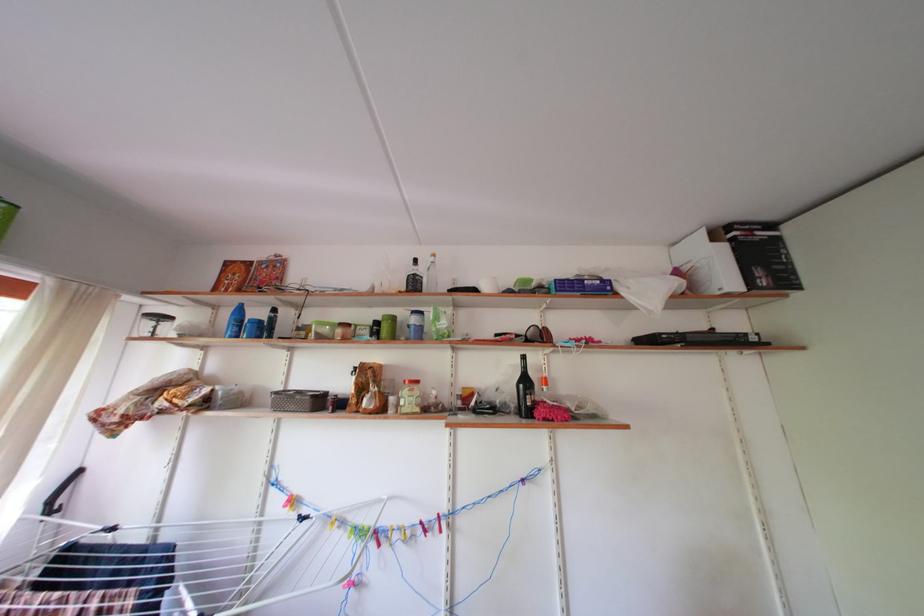
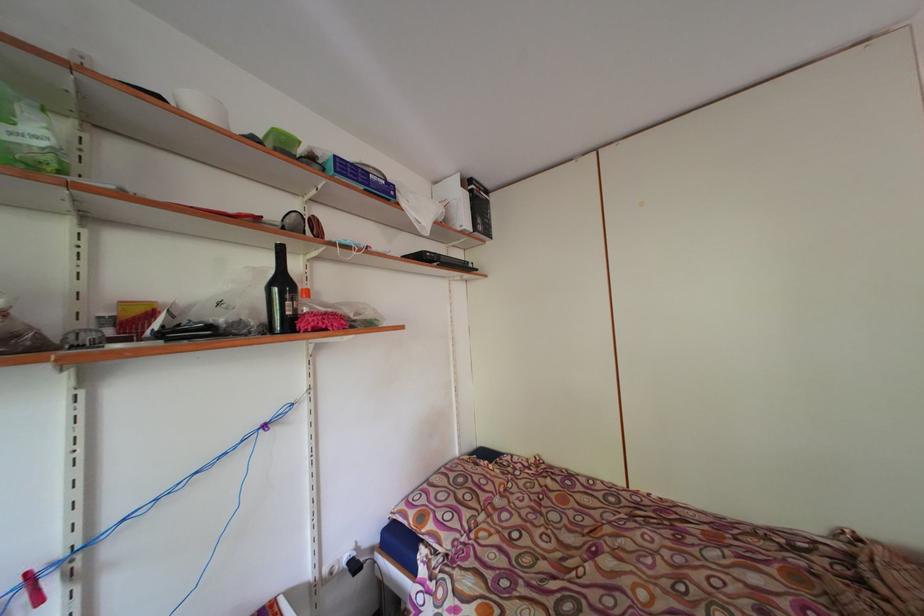
Locate, in the second image, the point that corresponds to pixel 533 387 in the first image.

(290, 289)